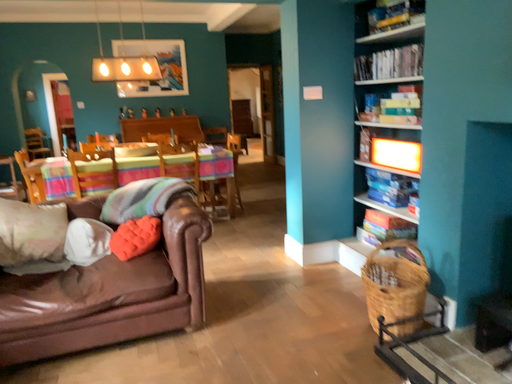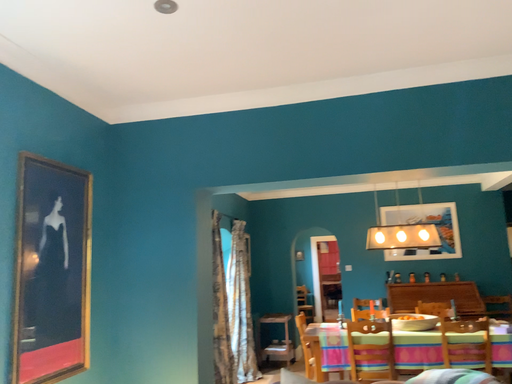
Question: Which way did the camera rotate in the video?

Choices:
 (A) rotated upward
 (B) rotated downward

Answer: (A)